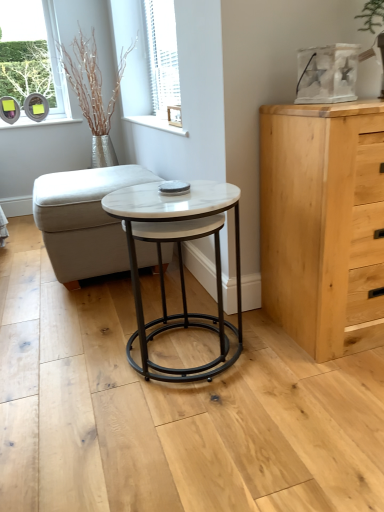
Where is `free space in front of white marble coffee table at center`? The width and height of the screenshot is (384, 512). free space in front of white marble coffee table at center is located at coordinates (179, 440).